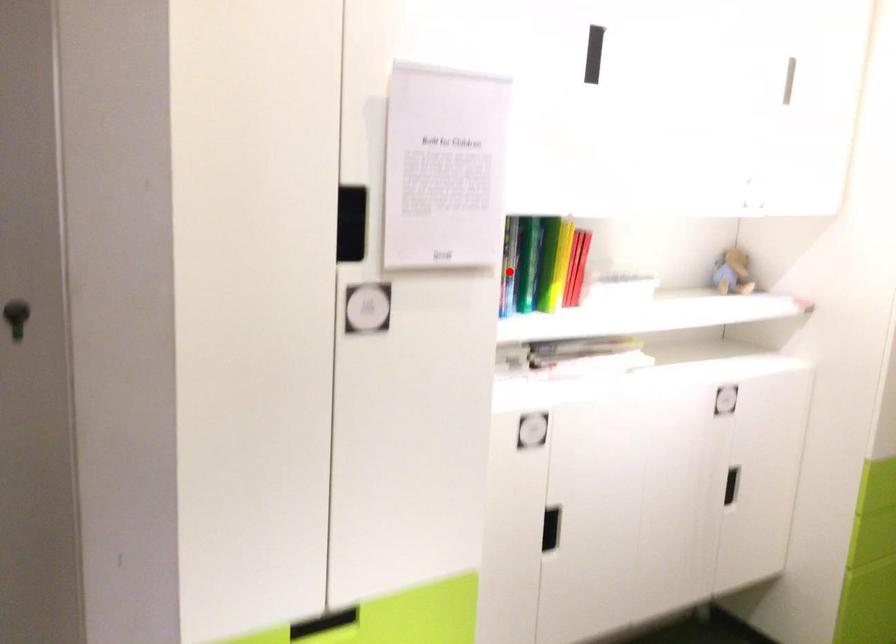
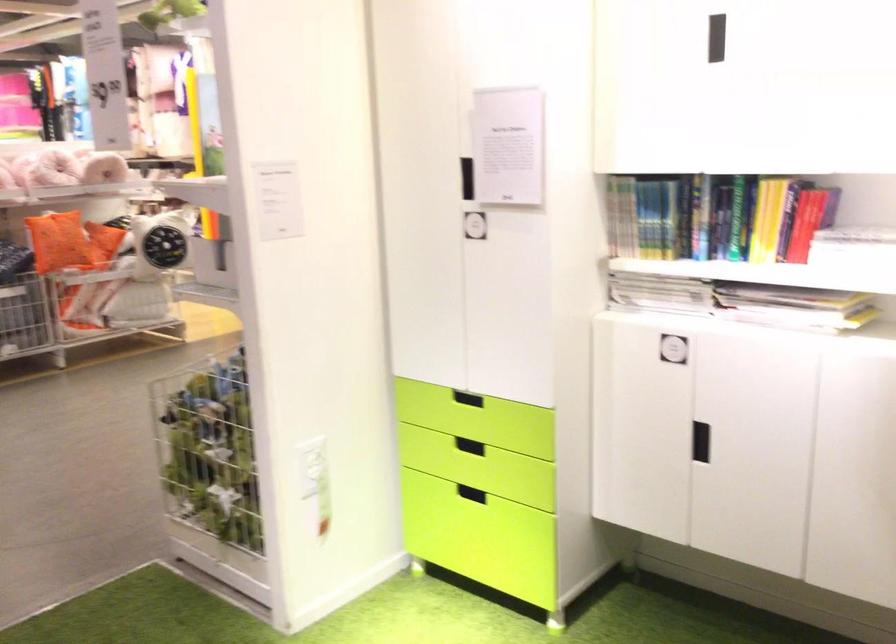
Question: I am providing you with two images of the same scene from different viewpoints. A red point is shown in image1. For the corresponding object point in image2, is it positioned nearer or farther from the camera?

Choices:
 (A) Nearer
 (B) Farther

Answer: (B)